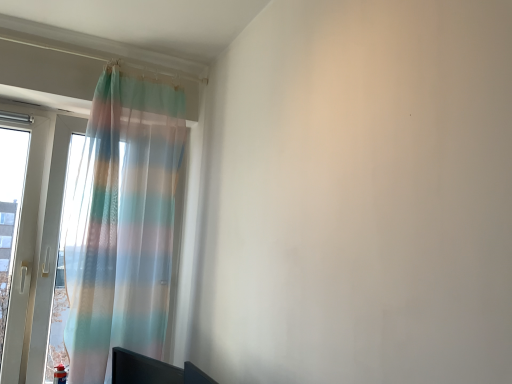
This screenshot has height=384, width=512. Describe the element at coordinates (123, 223) in the screenshot. I see `translucent pastel striped curtain at left` at that location.

The height and width of the screenshot is (384, 512). Identify the location of translucent pastel striped curtain at left. (123, 223).

This screenshot has width=512, height=384. What do you see at coordinates (152, 370) in the screenshot?
I see `black glossy monitor at lower left` at bounding box center [152, 370].

The height and width of the screenshot is (384, 512). In order to click on black glossy monitor at lower left in this screenshot , I will do `click(152, 370)`.

Where is `translucent pastel striped curtain at left`? Image resolution: width=512 pixels, height=384 pixels. translucent pastel striped curtain at left is located at coordinates 123,223.

Can you confirm if black glossy monitor at lower left is positioned to the left of translucent pastel striped curtain at left?

Incorrect, black glossy monitor at lower left is not on the left side of translucent pastel striped curtain at left.

Consider the image. Relative to translucent pastel striped curtain at left, is black glossy monitor at lower left in front or behind?

black glossy monitor at lower left is positioned closer to the viewer than translucent pastel striped curtain at left.

Which is in front, point (135, 357) or point (106, 70)?

Positioned in front is point (135, 357).

From the image's perspective, would you say black glossy monitor at lower left is positioned over translucent pastel striped curtain at left?

Incorrect, from the image's perspective, black glossy monitor at lower left is lower than translucent pastel striped curtain at left.

From a real-world perspective, is black glossy monitor at lower left positioned above or below translucent pastel striped curtain at left?

From a real-world perspective, black glossy monitor at lower left is physically below translucent pastel striped curtain at left.

Consider the image. Considering the sizes of black glossy monitor at lower left and translucent pastel striped curtain at left in the image, is black glossy monitor at lower left wider or thinner than translucent pastel striped curtain at left?

Considering their sizes, black glossy monitor at lower left looks slimmer than translucent pastel striped curtain at left.

From their relative heights in the image, would you say black glossy monitor at lower left is taller or shorter than translucent pastel striped curtain at left?

black glossy monitor at lower left is shorter than translucent pastel striped curtain at left.

Considering the sizes of objects black glossy monitor at lower left and translucent pastel striped curtain at left in the image provided, who is bigger, black glossy monitor at lower left or translucent pastel striped curtain at left?

With larger size is translucent pastel striped curtain at left.

Can we say black glossy monitor at lower left lies outside translucent pastel striped curtain at left?

black glossy monitor at lower left is positioned outside translucent pastel striped curtain at left.

Would you say black glossy monitor at lower left is a long distance from translucent pastel striped curtain at left?

No, black glossy monitor at lower left is in close proximity to translucent pastel striped curtain at left.

Is black glossy monitor at lower left facing away from translucent pastel striped curtain at left?

No, black glossy monitor at lower left's orientation is not away from translucent pastel striped curtain at left.

How different are the orientations of black glossy monitor at lower left and translucent pastel striped curtain at left in degrees?

68.8 degrees.

Where is `furniture that is under the translucent pastel striped curtain at left (from a real-world perspective)`? The image size is (512, 384). furniture that is under the translucent pastel striped curtain at left (from a real-world perspective) is located at coordinates (152, 370).

From the picture: Visually, is translucent pastel striped curtain at left positioned to the left or to the right of black glossy monitor at lower left?

translucent pastel striped curtain at left is positioned on black glossy monitor at lower left's left side.

Is translucent pastel striped curtain at left closer to the viewer compared to black glossy monitor at lower left?

No, translucent pastel striped curtain at left is behind black glossy monitor at lower left.

Which is behind, point (158, 188) or point (131, 353)?

The point (158, 188) is more distant.

From the image's perspective, which is above, translucent pastel striped curtain at left or black glossy monitor at lower left?

translucent pastel striped curtain at left, from the image's perspective.

From a real-world perspective, which is physically above, translucent pastel striped curtain at left or black glossy monitor at lower left?

translucent pastel striped curtain at left.

Considering the relative sizes of translucent pastel striped curtain at left and black glossy monitor at lower left in the image provided, is translucent pastel striped curtain at left wider than black glossy monitor at lower left?

Yes.

Consider the image. Does translucent pastel striped curtain at left have a lesser height compared to black glossy monitor at lower left?

No, translucent pastel striped curtain at left is not shorter than black glossy monitor at lower left.

Is translucent pastel striped curtain at left bigger than black glossy monitor at lower left?

Indeed, translucent pastel striped curtain at left has a larger size compared to black glossy monitor at lower left.

Which is correct: translucent pastel striped curtain at left is inside black glossy monitor at lower left, or outside of it?

translucent pastel striped curtain at left lies outside black glossy monitor at lower left.

Is the surface of translucent pastel striped curtain at left in direct contact with black glossy monitor at lower left?

They are not placed beside each other.

Is translucent pastel striped curtain at left positioned with its back to black glossy monitor at lower left?

No.

You are a GUI agent. You are given a task and a screenshot of the screen. Output one action in this format:
    pyautogui.click(x=<x>, y=<y>)
    Task: Click on the curtain positioned vertically above the black glossy monitor at lower left (from a real-world perspective)
    Image resolution: width=512 pixels, height=384 pixels.
    Given the screenshot: What is the action you would take?
    pyautogui.click(x=123, y=223)

You are a GUI agent. You are given a task and a screenshot of the screen. Output one action in this format:
    pyautogui.click(x=<x>, y=<y>)
    Task: Click on the curtain located on the left of black glossy monitor at lower left
    The image size is (512, 384).
    Given the screenshot: What is the action you would take?
    pyautogui.click(x=123, y=223)

You are a GUI agent. You are given a task and a screenshot of the screen. Output one action in this format:
    pyautogui.click(x=<x>, y=<y>)
    Task: Click on the furniture that is below the translucent pastel striped curtain at left (from the image's perspective)
    
    Given the screenshot: What is the action you would take?
    [152, 370]